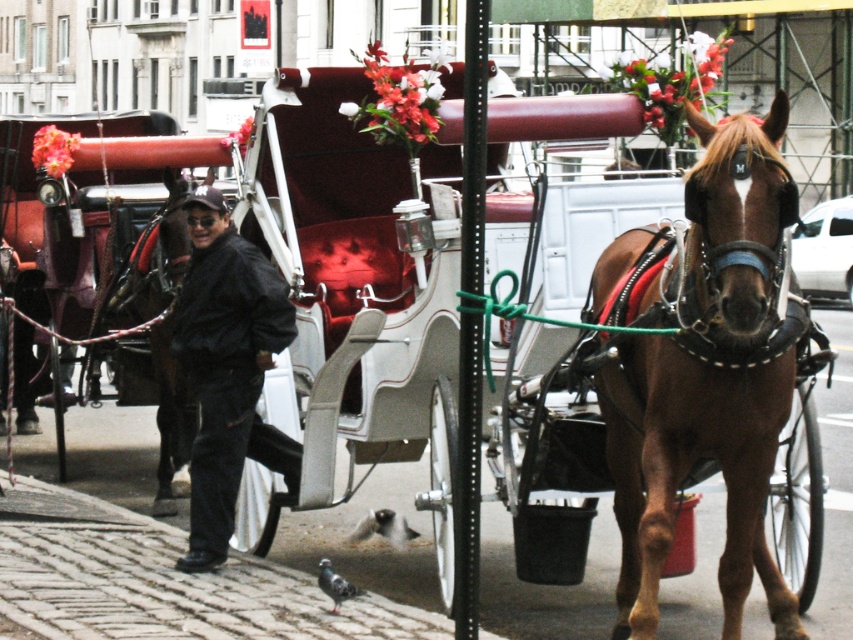
You are a photographer trying to capture a photo of the black matte jacket at center and the gray speckled pigeon at lower center. Which object should you focus on first if you want to ensure both are in the frame without moving the camera?

You should focus on the black matte jacket at center first because its larger width compared to the gray speckled pigeon at lower center means it will occupy more space in the frame, allowing you to adjust the camera angle to include both.

You are a photographer trying to capture the scene with the black matte jacket at center and the gray matte pigeon at lower center. Which object should you focus on first if you want to include both in your shot without moving the camera?

The black matte jacket at center is positioned on the left side of the gray matte pigeon at lower center, so you should focus on the black matte jacket at center first to ensure both are in frame.

You are a photographer standing at the point marked by the coordinates point (227,369). You want to take a photo of the horse and the carriage. Which object is directly in front of you at that point?

The point (227,369) marks the black matte jacket at center, so the black matte jacket at center is directly in front of you at that point.